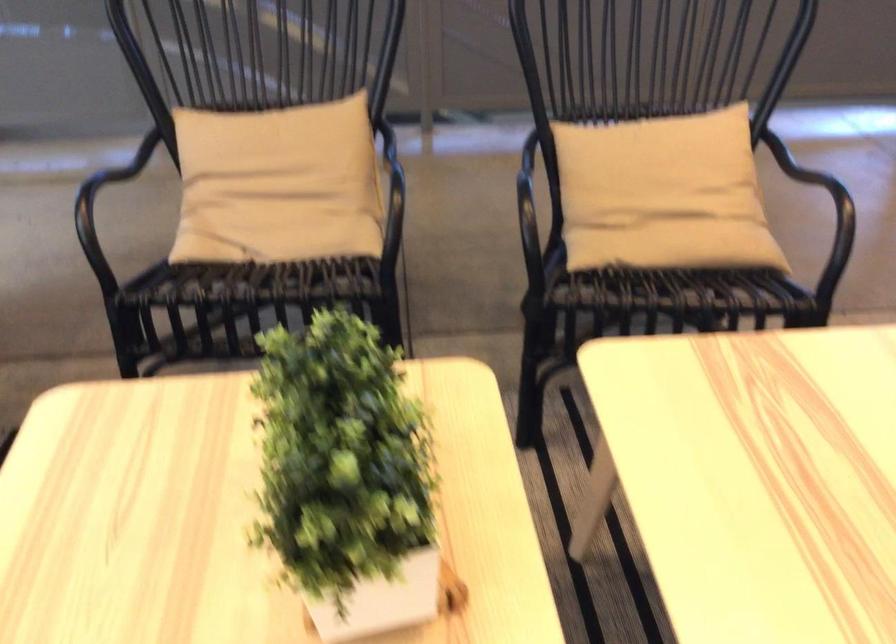
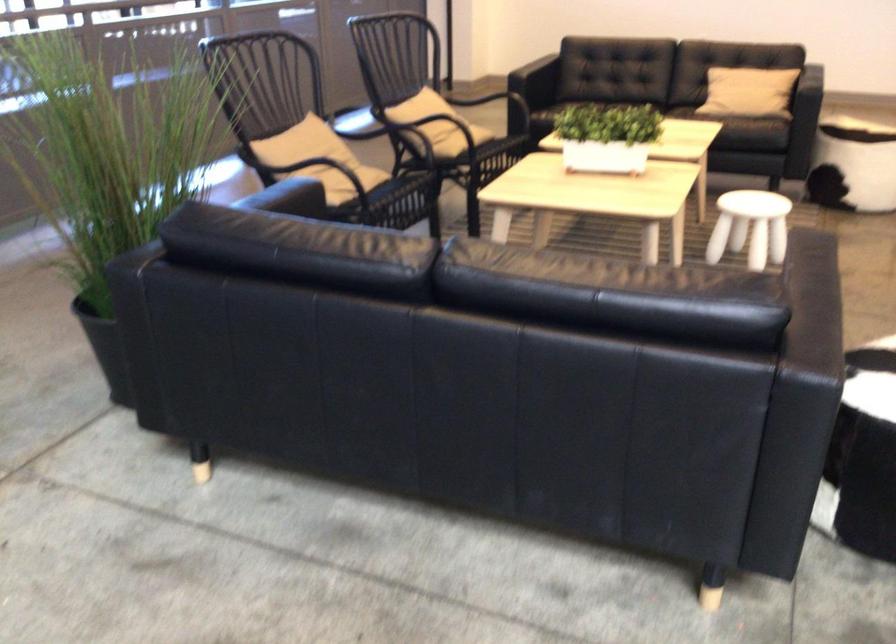
Where in the second image is the point corresponding to [617,164] from the first image?

(431, 111)